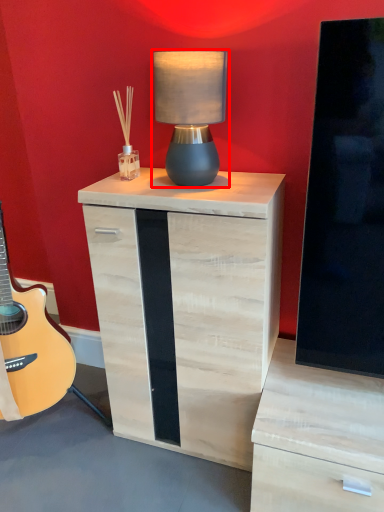
Question: From the image, what is the correct spatial relationship of table lamp (annotated by the red box) in relation to nightstand?

Choices:
 (A) left
 (B) right

Answer: (B)